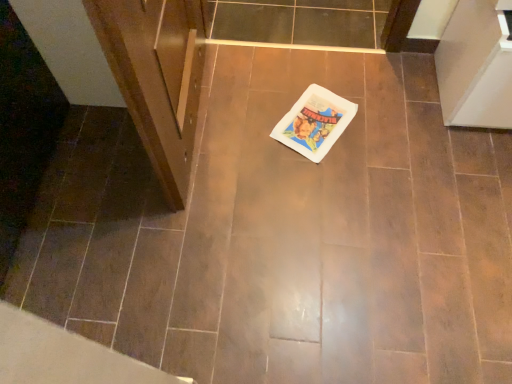
Find the location of `free space in front of white glossy cabinet at right`. free space in front of white glossy cabinet at right is located at coordinates (460, 181).